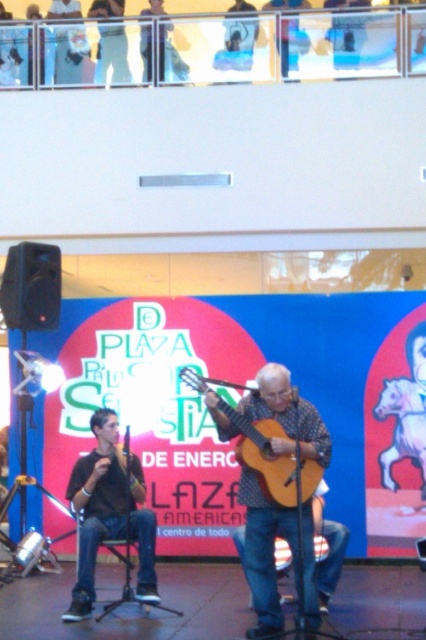
Question: Is the position of matte black microphone at lower left less distant than that of acoustic wood guitar at center?

Choices:
 (A) yes
 (B) no

Answer: (B)

Question: Can you confirm if acoustic guitar at center is positioned to the left of acoustic wood guitar at center?

Choices:
 (A) yes
 (B) no

Answer: (B)

Question: Based on their relative distances, which object is nearer to the acoustic wood guitar at center?

Choices:
 (A) matte black microphone at lower left
 (B) acoustic guitar at center

Answer: (B)

Question: Does acoustic guitar at center have a lesser width compared to acoustic wood guitar at center?

Choices:
 (A) yes
 (B) no

Answer: (A)

Question: Which is farther from the matte black microphone at lower left?

Choices:
 (A) acoustic guitar at center
 (B) acoustic wood guitar at center

Answer: (B)

Question: Which of these objects is positioned farthest from the acoustic wood guitar at center?

Choices:
 (A) matte black microphone at lower left
 (B) acoustic guitar at center

Answer: (A)